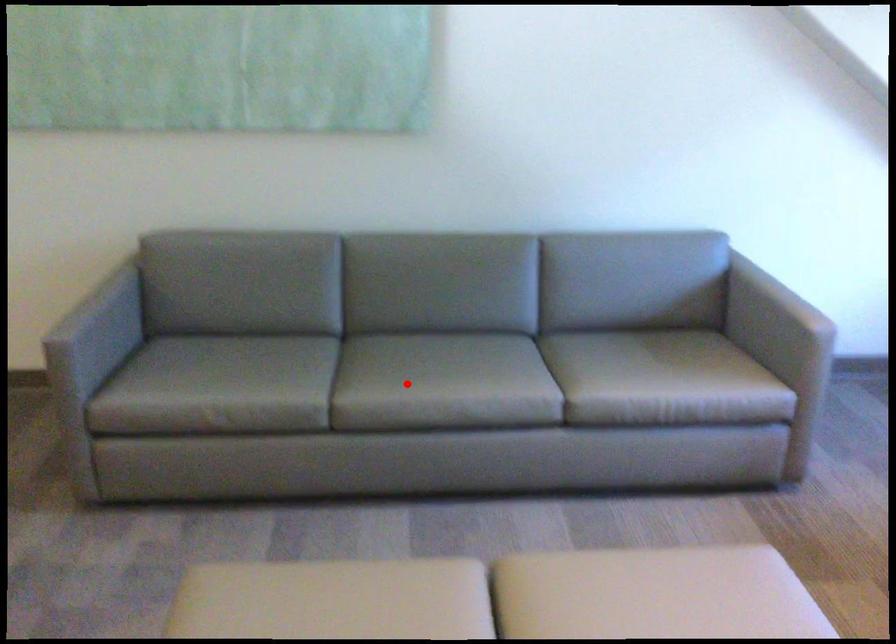
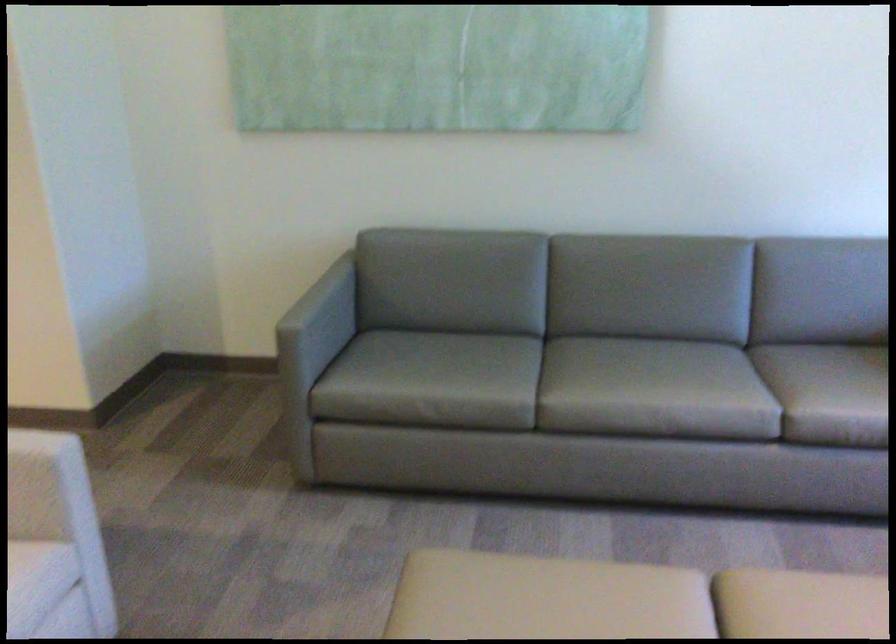
Locate, in the second image, the point that corresponds to the highlighted location in the first image.

(613, 386)